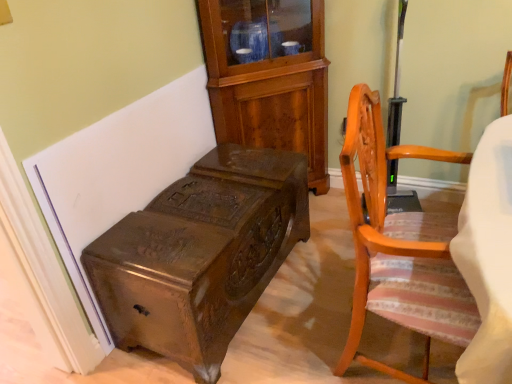
Question: Is polished dark wood trunk at lower left positioned with its back to mahogany cabinet at upper center?

Choices:
 (A) yes
 (B) no

Answer: (B)

Question: From the image's perspective, is polished dark wood trunk at lower left located above mahogany cabinet at upper center?

Choices:
 (A) yes
 (B) no

Answer: (B)

Question: From a real-world perspective, is polished dark wood trunk at lower left positioned over mahogany cabinet at upper center based on gravity?

Choices:
 (A) yes
 (B) no

Answer: (B)

Question: Does polished dark wood trunk at lower left have a lesser height compared to mahogany cabinet at upper center?

Choices:
 (A) no
 (B) yes

Answer: (B)

Question: Is polished dark wood trunk at lower left positioned before mahogany cabinet at upper center?

Choices:
 (A) yes
 (B) no

Answer: (A)

Question: Does polished dark wood trunk at lower left have a greater width compared to mahogany cabinet at upper center?

Choices:
 (A) no
 (B) yes

Answer: (B)

Question: Considering the relative positions of mahogany cabinet at upper center and polished dark wood trunk at lower left in the image provided, is mahogany cabinet at upper center to the right of polished dark wood trunk at lower left from the viewer's perspective?

Choices:
 (A) yes
 (B) no

Answer: (A)

Question: Does mahogany cabinet at upper center have a lesser height compared to polished dark wood trunk at lower left?

Choices:
 (A) no
 (B) yes

Answer: (A)

Question: From the image's perspective, is mahogany cabinet at upper center below polished dark wood trunk at lower left?

Choices:
 (A) yes
 (B) no

Answer: (B)

Question: Is mahogany cabinet at upper center facing towards polished dark wood trunk at lower left?

Choices:
 (A) yes
 (B) no

Answer: (B)

Question: From the image's perspective, is mahogany cabinet at upper center on top of polished dark wood trunk at lower left?

Choices:
 (A) no
 (B) yes

Answer: (B)

Question: Considering the relative positions of mahogany cabinet at upper center and polished dark wood trunk at lower left in the image provided, is mahogany cabinet at upper center behind polished dark wood trunk at lower left?

Choices:
 (A) yes
 (B) no

Answer: (A)

Question: From the image's perspective, does light brown wood chair at right appear higher than polished dark wood trunk at lower left?

Choices:
 (A) no
 (B) yes

Answer: (B)